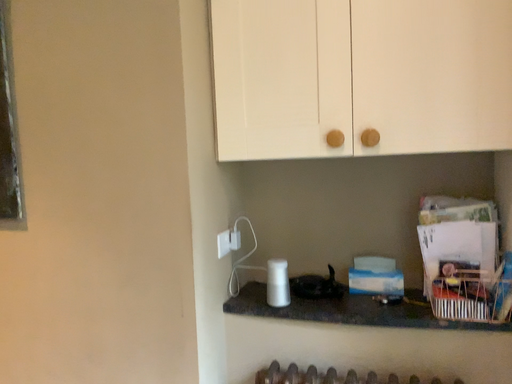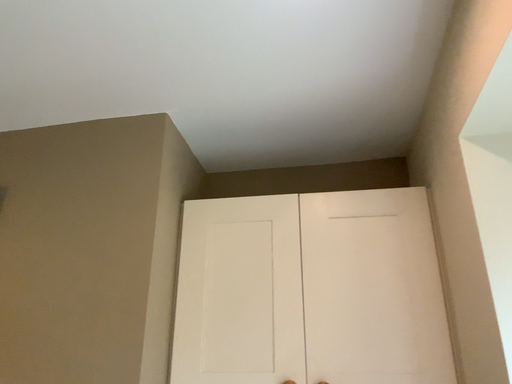
Question: Which way did the camera rotate in the video?

Choices:
 (A) rotated left
 (B) rotated right

Answer: (B)